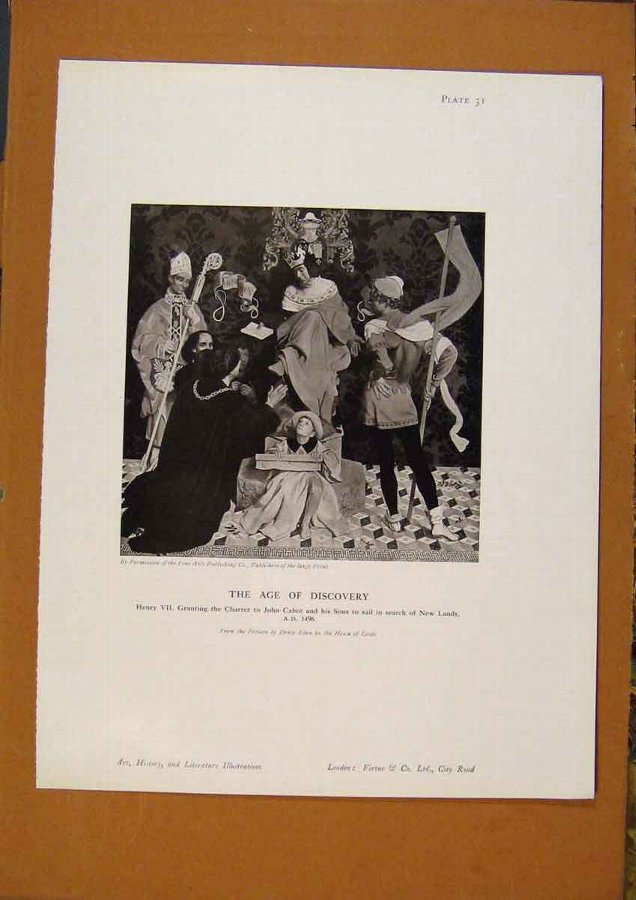
Locate an element on the screen. brown background or wall is located at coordinates (547, 853).